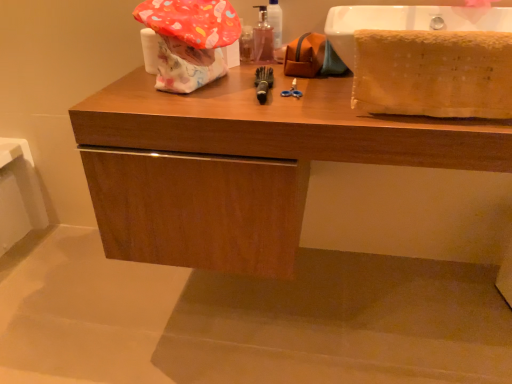
Question: Can you confirm if soft yellow towel at right is wider than translucent plastic mouthwash at center?

Choices:
 (A) yes
 (B) no

Answer: (A)

Question: Can you confirm if soft yellow towel at right is bigger than translucent plastic mouthwash at center?

Choices:
 (A) yes
 (B) no

Answer: (A)

Question: Is soft yellow towel at right to the right of translucent plastic mouthwash at center from the viewer's perspective?

Choices:
 (A) no
 (B) yes

Answer: (B)

Question: Can you confirm if soft yellow towel at right is thinner than translucent plastic mouthwash at center?

Choices:
 (A) no
 (B) yes

Answer: (A)

Question: Can you see soft yellow towel at right touching translucent plastic mouthwash at center?

Choices:
 (A) no
 (B) yes

Answer: (A)

Question: From the image's perspective, is soft yellow towel at right on top of translucent plastic mouthwash at center?

Choices:
 (A) yes
 (B) no

Answer: (B)

Question: Does translucent plastic mouthwash at center have a larger size compared to wooden cabinet at center?

Choices:
 (A) no
 (B) yes

Answer: (A)

Question: Can you confirm if translucent plastic mouthwash at center is thinner than wooden cabinet at center?

Choices:
 (A) no
 (B) yes

Answer: (B)

Question: Is wooden cabinet at center at the back of translucent plastic mouthwash at center?

Choices:
 (A) no
 (B) yes

Answer: (A)

Question: Is translucent plastic mouthwash at center positioned beyond the bounds of wooden cabinet at center?

Choices:
 (A) yes
 (B) no

Answer: (A)

Question: Does translucent plastic mouthwash at center have a lesser height compared to wooden cabinet at center?

Choices:
 (A) yes
 (B) no

Answer: (A)

Question: From a real-world perspective, is translucent plastic mouthwash at center located higher than wooden cabinet at center?

Choices:
 (A) yes
 (B) no

Answer: (A)

Question: Is soft yellow towel at right to the left of black rubber toothbrush at center from the viewer's perspective?

Choices:
 (A) yes
 (B) no

Answer: (B)